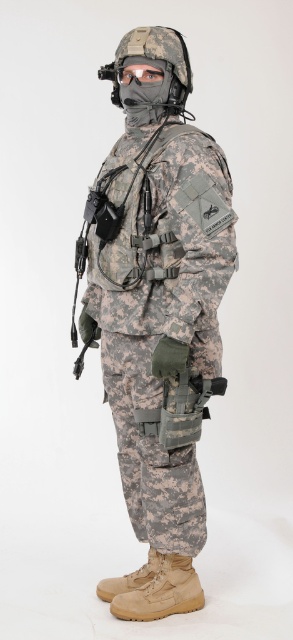
Question: Which of the following is the farthest from the observer?

Choices:
 (A) matte black goggles at center
 (B) camouflage fabric uniform at center

Answer: (A)

Question: In this image, where is camouflage fabric uniform at center located relative to matte black goggles at center?

Choices:
 (A) right
 (B) left

Answer: (A)

Question: Does camouflage fabric uniform at center have a smaller size compared to matte black goggles at center?

Choices:
 (A) no
 (B) yes

Answer: (A)

Question: Is camouflage fabric uniform at center to the right of matte black goggles at center from the viewer's perspective?

Choices:
 (A) yes
 (B) no

Answer: (A)